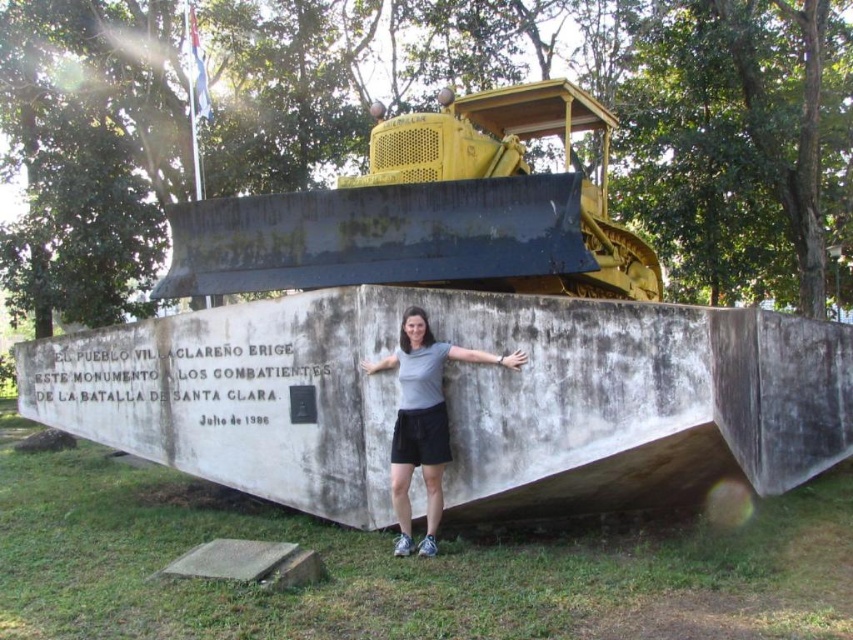
Question: Is yellow metallic bulldozer at upper center positioned before gray fabric shirt at center?

Choices:
 (A) no
 (B) yes

Answer: (A)

Question: Which point appears farthest from the camera in this image?

Choices:
 (A) (477, 360)
 (B) (403, 234)

Answer: (B)

Question: Does yellow metallic bulldozer at upper center appear on the left side of gray fabric shirt at center?

Choices:
 (A) yes
 (B) no

Answer: (A)

Question: Is yellow metallic bulldozer at upper center positioned in front of gray fabric shirt at center?

Choices:
 (A) yes
 (B) no

Answer: (B)

Question: Which of the following is the farthest from the observer?

Choices:
 (A) gray fabric shirt at center
 (B) yellow metallic bulldozer at upper center

Answer: (B)